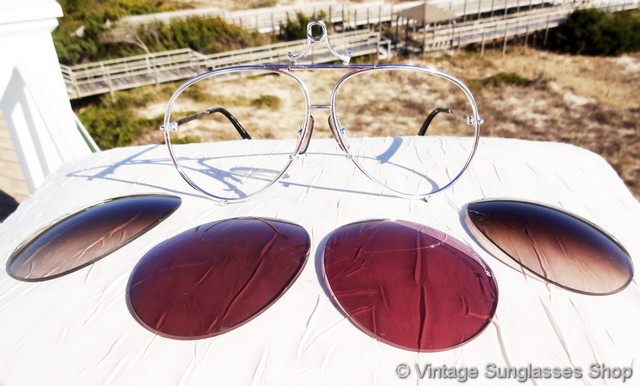
Find the location of a particular element. This screenshot has height=386, width=640. small white table top is located at coordinates click(x=288, y=358).